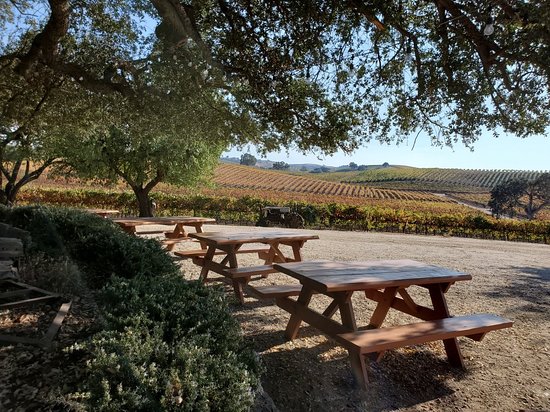
The image size is (550, 412). Find the location of `place to sit down`. place to sit down is located at coordinates (415, 332), (273, 290).